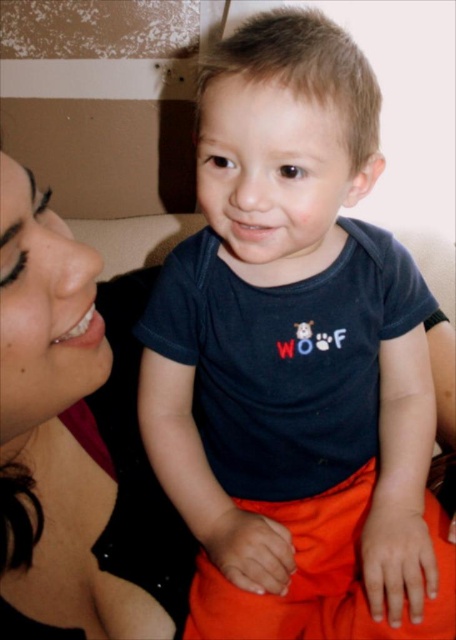
Question: Does dark blue t-shirt at center appear on the left side of matte black hair at left?

Choices:
 (A) yes
 (B) no

Answer: (B)

Question: Which of the following is the closest to the observer?

Choices:
 (A) (300, 339)
 (B) (0, 348)

Answer: (B)

Question: Is dark blue t-shirt at center above matte black hair at left?

Choices:
 (A) yes
 (B) no

Answer: (A)

Question: Does dark blue t-shirt at center lie in front of matte black hair at left?

Choices:
 (A) no
 (B) yes

Answer: (A)

Question: Which object is farther from the camera taking this photo?

Choices:
 (A) dark blue t-shirt at center
 (B) matte black hair at left

Answer: (A)

Question: Among these objects, which one is nearest to the camera?

Choices:
 (A) matte black hair at left
 (B) dark blue t-shirt at center

Answer: (A)